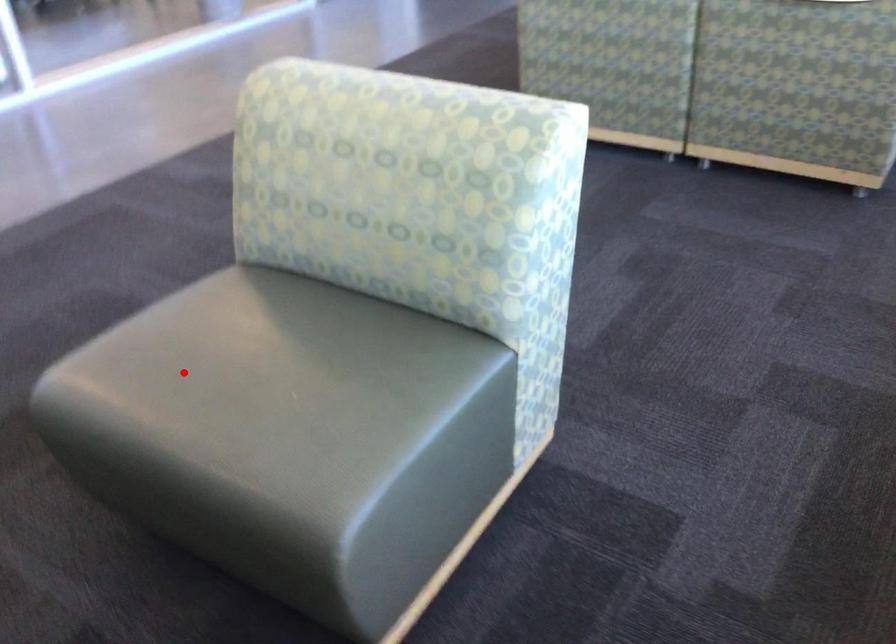
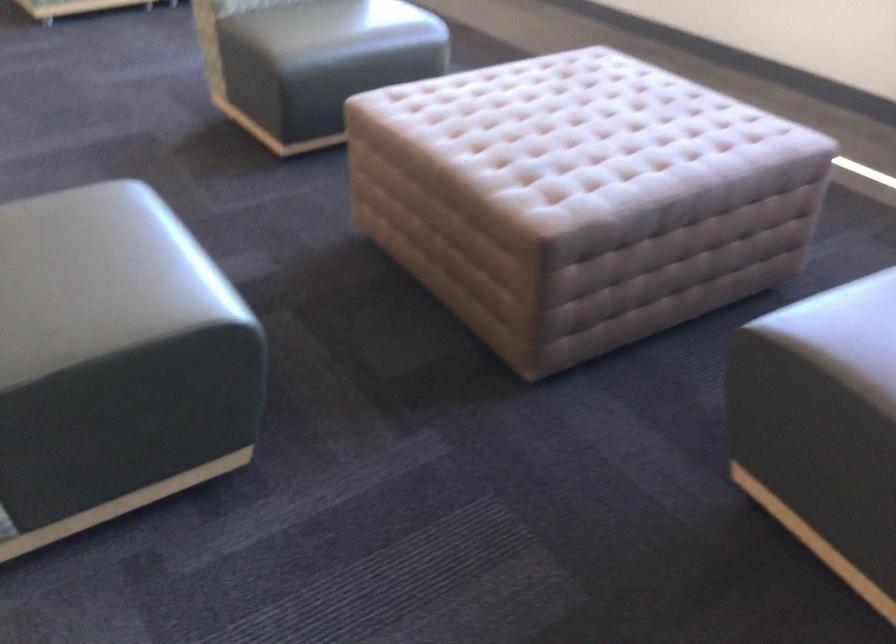
Question: I am providing you with two images of the same scene from different viewpoints. Given a red point in image1, look at the same physical point in image2. Is it:

Choices:
 (A) Closer to the viewpoint
 (B) Farther from the viewpoint

Answer: (B)